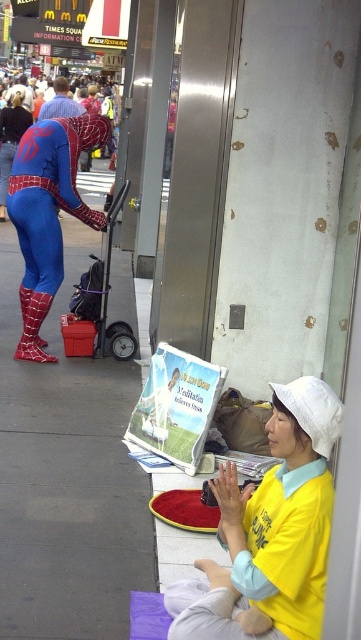
In the scene shown: Between matte paper comic book at lower center and blue spandex suit at left, which one has less height?

With less height is matte paper comic book at lower center.

Who is more distant from viewer, (197, 456) or (50, 109)?

Positioned behind is point (50, 109).

You are a GUI agent. You are given a task and a screenshot of the screen. Output one action in this format:
    pyautogui.click(x=<x>, y=<y>)
    Task: Click on the matte paper comic book at lower center
    
    Given the screenshot: What is the action you would take?
    pyautogui.click(x=176, y=406)

Is shiny spandex suit at left wider than matte paper comic book at lower center?

Indeed, shiny spandex suit at left has a greater width compared to matte paper comic book at lower center.

Is shiny spandex suit at left taller than matte paper comic book at lower center?

Correct, shiny spandex suit at left is much taller as matte paper comic book at lower center.

Which is in front, point (24, 144) or point (189, 369)?

Point (189, 369) is more forward.

Image resolution: width=361 pixels, height=640 pixels. In order to click on shiny spandex suit at left in this screenshot , I will do `click(48, 212)`.

Can you confirm if concrete sidewalk at lower left is taller than matte paper comic book at lower center?

No.

Who is positioned more to the right, concrete sidewalk at lower left or matte paper comic book at lower center?

matte paper comic book at lower center is more to the right.

Which is in front, point (10, 326) or point (196, 428)?

Positioned in front is point (196, 428).

Locate an element on the screen. Image resolution: width=361 pixels, height=640 pixels. concrete sidewalk at lower left is located at coordinates (67, 476).